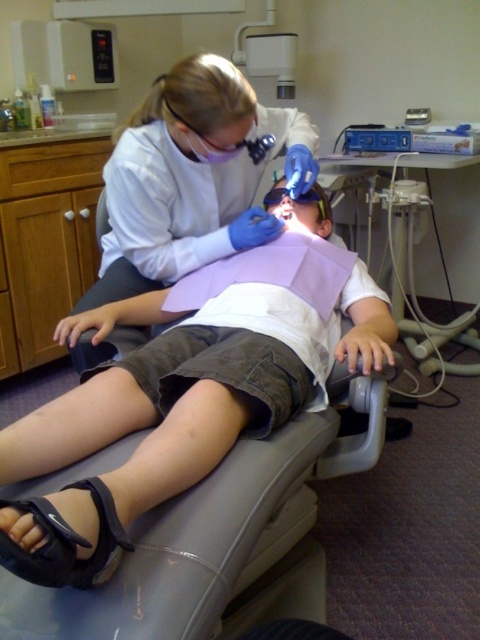
Question: Does white glossy lab coat at upper center have a smaller size compared to blue plastic dental chair at center?

Choices:
 (A) yes
 (B) no

Answer: (A)

Question: Does white glossy lab coat at upper center appear under black synthetic sandal at lower left?

Choices:
 (A) no
 (B) yes

Answer: (A)

Question: Considering the real-world distances, which object is farthest from the blue plastic dental chair at center?

Choices:
 (A) white glossy lab coat at upper center
 (B) black synthetic sandal at lower left

Answer: (B)

Question: Which point is closer to the camera taking this photo?

Choices:
 (A) (262, 124)
 (B) (396, 170)
 (C) (45, 499)

Answer: (C)

Question: Which object is the farthest from the blue plastic dental chair at center?

Choices:
 (A) black synthetic sandal at lower left
 (B) white glossy lab coat at upper center

Answer: (A)

Question: Is white glossy lab coat at upper center further to the viewer compared to black synthetic sandal at lower left?

Choices:
 (A) yes
 (B) no

Answer: (A)